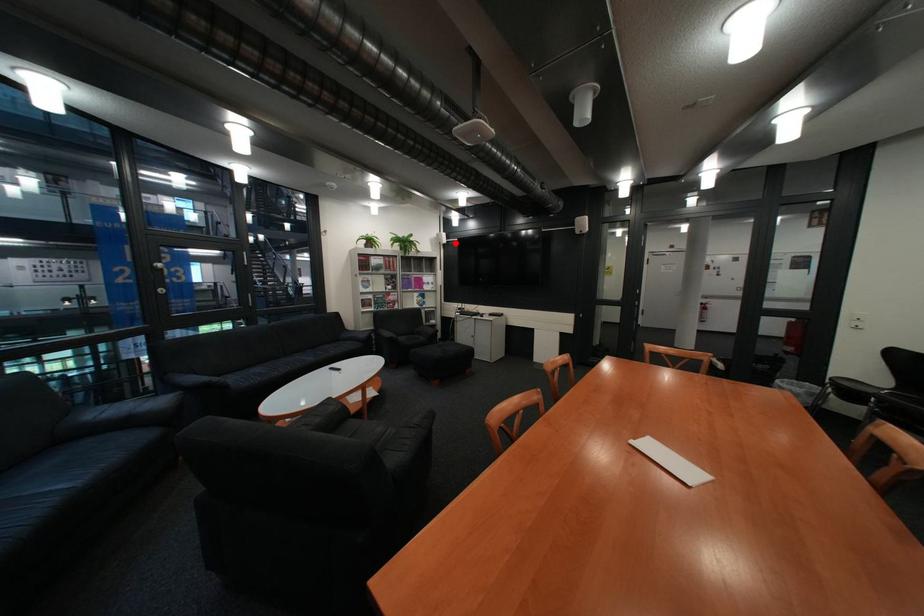
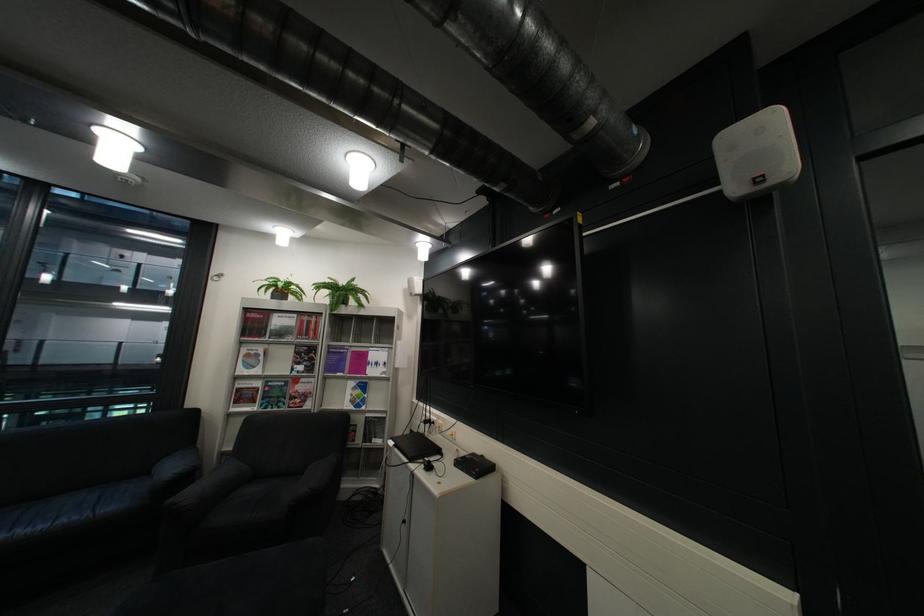
Question: A red point is marked in image1. In image2, is the corresponding 3D point closer to the camera or farther? Reply with the corresponding letter.

Choices:
 (A) The corresponding 3D point is closer.
 (B) The corresponding 3D point is farther.

Answer: (B)